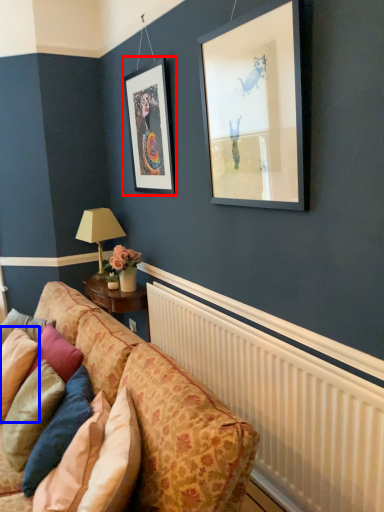
Question: Which of the following is the closest to the observer, picture frame (highlighted by a red box) or pillow (highlighted by a blue box)?

Choices:
 (A) picture frame
 (B) pillow

Answer: (B)